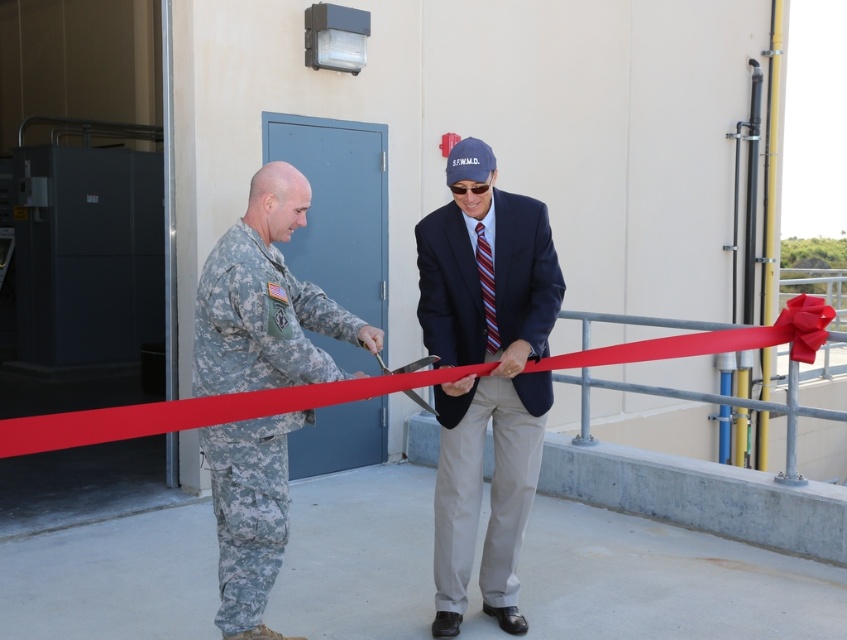
Question: Which object is closer to the camera taking this photo?

Choices:
 (A) red matte ribbon at center
 (B) camouflage fabric uniform at center

Answer: (B)

Question: Is dark blue suit at center below camouflage fabric uniform at center?

Choices:
 (A) yes
 (B) no

Answer: (B)

Question: Can you confirm if dark blue suit at center is smaller than red matte ribbon at center?

Choices:
 (A) no
 (B) yes

Answer: (A)

Question: Which point is farther to the camera?

Choices:
 (A) (246, 460)
 (B) (72, 445)
 (C) (436, 339)

Answer: (C)

Question: Is camouflage fabric uniform at center to the left of red matte ribbon at center from the viewer's perspective?

Choices:
 (A) yes
 (B) no

Answer: (A)

Question: Which of the following is the closest to the observer?

Choices:
 (A) dark blue suit at center
 (B) red matte ribbon at center
 (C) camouflage fabric uniform at center

Answer: (C)